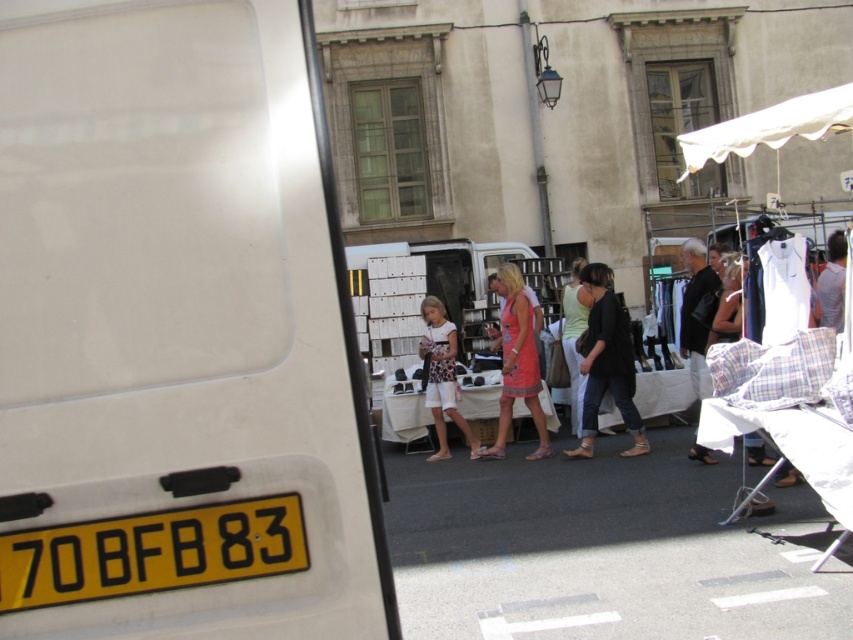
You are a pedestrian standing on the street and want to buy a black leather jacket at center. To reach it, you need to walk past the yellow plastic license plate at lower left. Is the path clear between them?

The yellow plastic license plate at lower left is closer to the viewer than black leather jacket at center, so the path between them is clear for you to walk past the license plate to reach the jacket.

You are a customer at the flea market and want to find shade to avoid the sun. Which object between the white fabric canopy at upper right and the dark gray fabric shirt at center would provide better shade?

The white fabric canopy at upper right is much taller than the dark gray fabric shirt at center, so it would provide better shade.